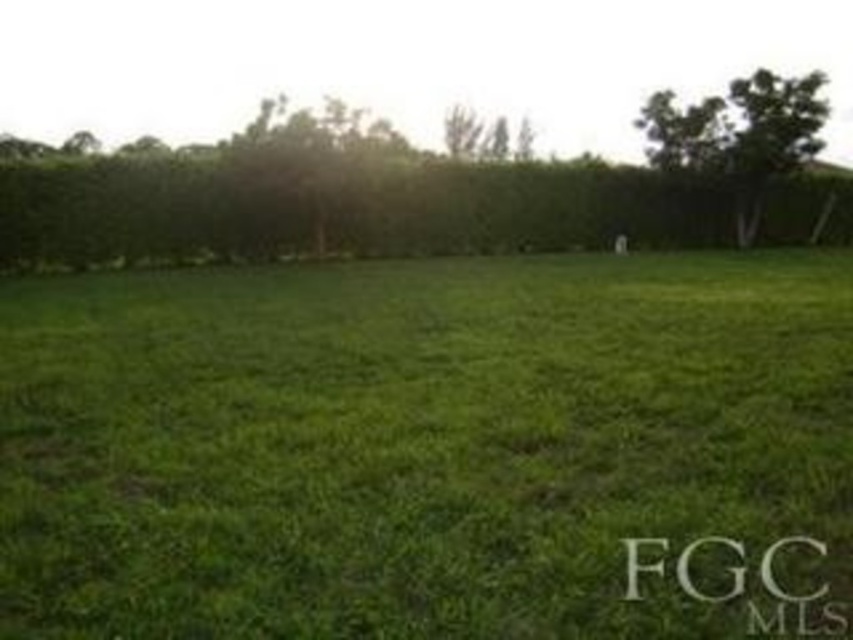
Question: Does green grass at center have a lesser width compared to green leafy hedge at upper center?

Choices:
 (A) yes
 (B) no

Answer: (A)

Question: Can you confirm if green grass at center is wider than green leafy hedge at upper center?

Choices:
 (A) yes
 (B) no

Answer: (B)

Question: Does green grass at center appear on the right side of green leafy hedge at upper center?

Choices:
 (A) no
 (B) yes

Answer: (A)